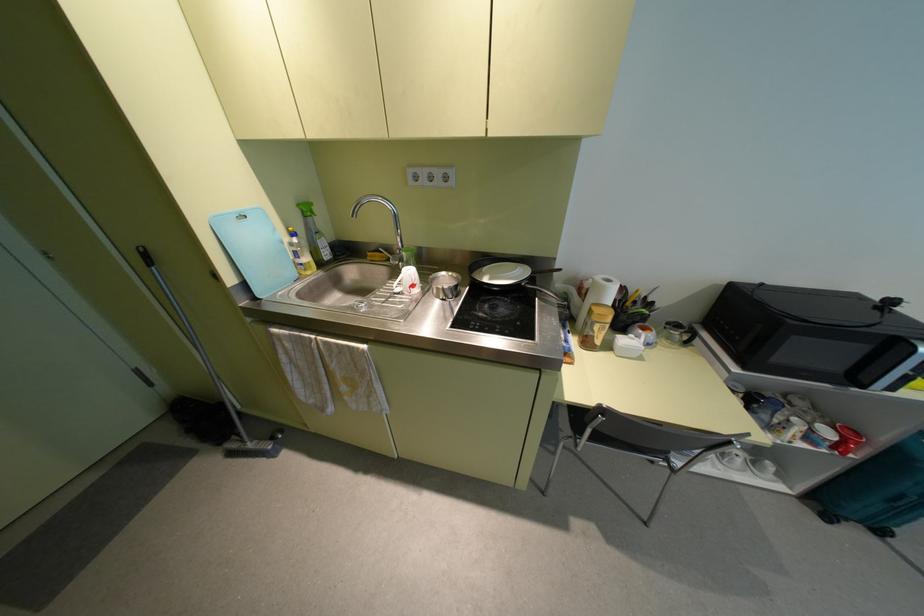
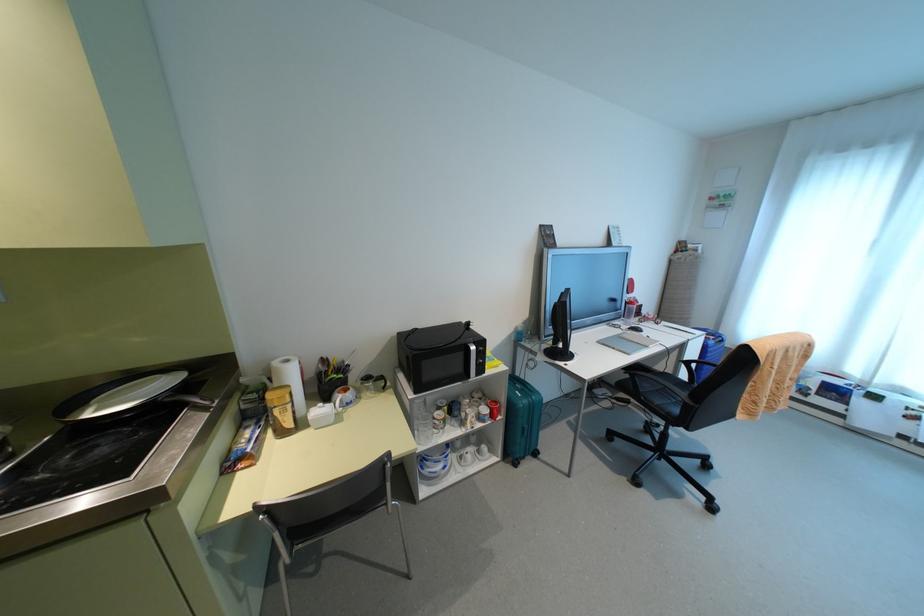
Question: The images are taken continuously from a first-person perspective. In which direction is your viewpoint rotating?

Choices:
 (A) Left
 (B) Right
 (C) Up
 (D) Down

Answer: (B)